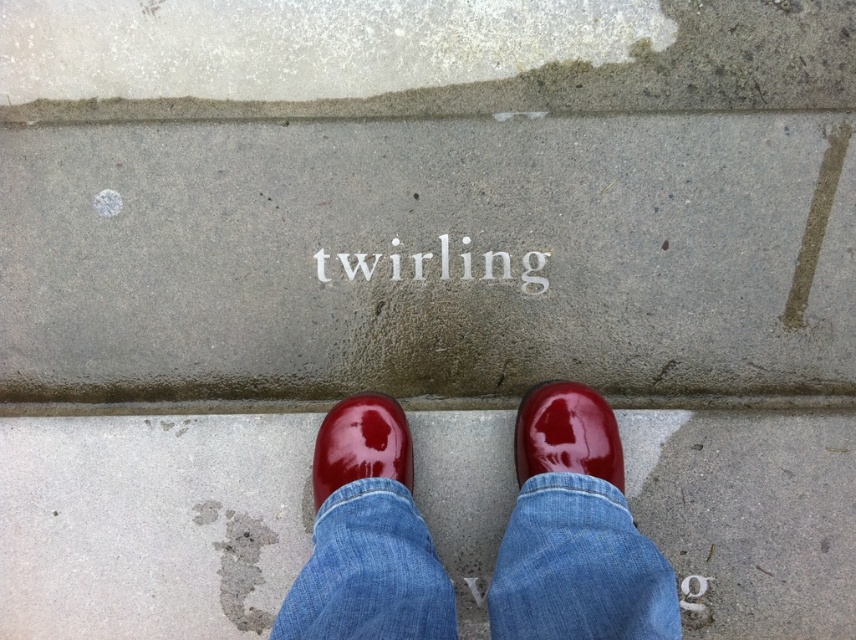
Question: Observing the image, what is the correct spatial positioning of glossy red shoes at center in reference to blue denim jeans at center?

Choices:
 (A) above
 (B) below

Answer: (A)

Question: Which object is closer to the camera taking this photo?

Choices:
 (A) blue denim jeans at center
 (B) glossy concrete curb at center

Answer: (A)

Question: From the image, what is the correct spatial relationship of gray concrete at center in relation to glossy red shoe at center?

Choices:
 (A) below
 (B) above

Answer: (B)

Question: Which point is farther to the camera?

Choices:
 (A) glossy concrete curb at center
 (B) gray concrete at center
 (C) glossy red shoes at center

Answer: (A)

Question: In this image, where is gray concrete at center located relative to glossy red shoe at center?

Choices:
 (A) above
 (B) below

Answer: (A)

Question: Which point is closer to the camera?

Choices:
 (A) glossy red shoe at center
 (B) gray concrete at center
 (C) glossy red shoes at center
 (D) glossy concrete curb at center

Answer: (A)